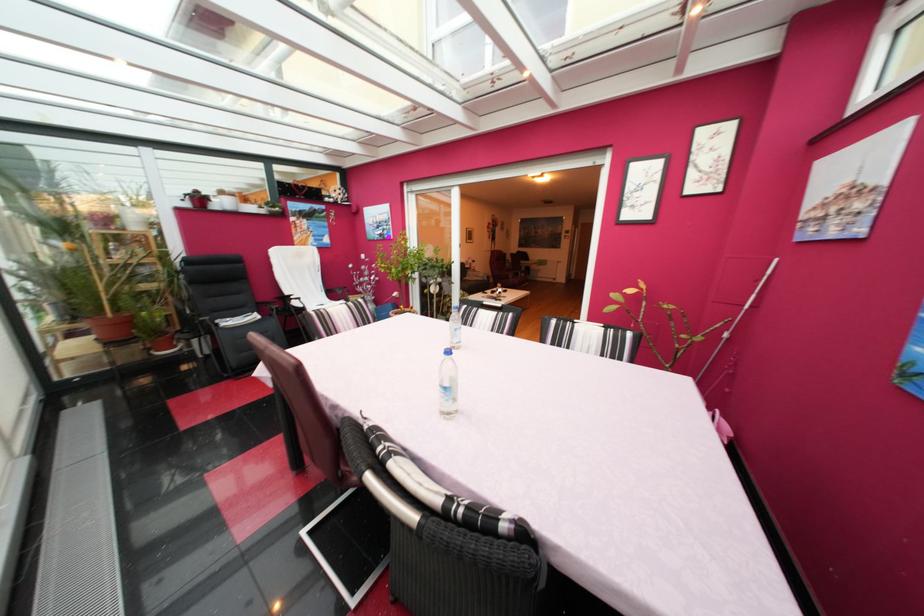
At what (x,y) coordinates should I click in order to perform the action: click on black chair armrest. Please return your answer as a coordinate pair (x, y). Looking at the image, I should click on (266, 307).